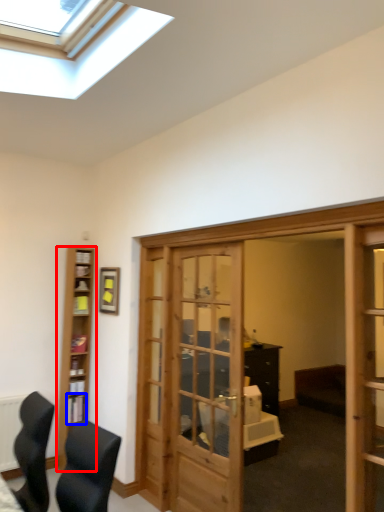
Question: Which object appears farthest to the camera in this image, cabinetry (highlighted by a red box) or shelf (highlighted by a blue box)?

Choices:
 (A) cabinetry
 (B) shelf

Answer: (B)